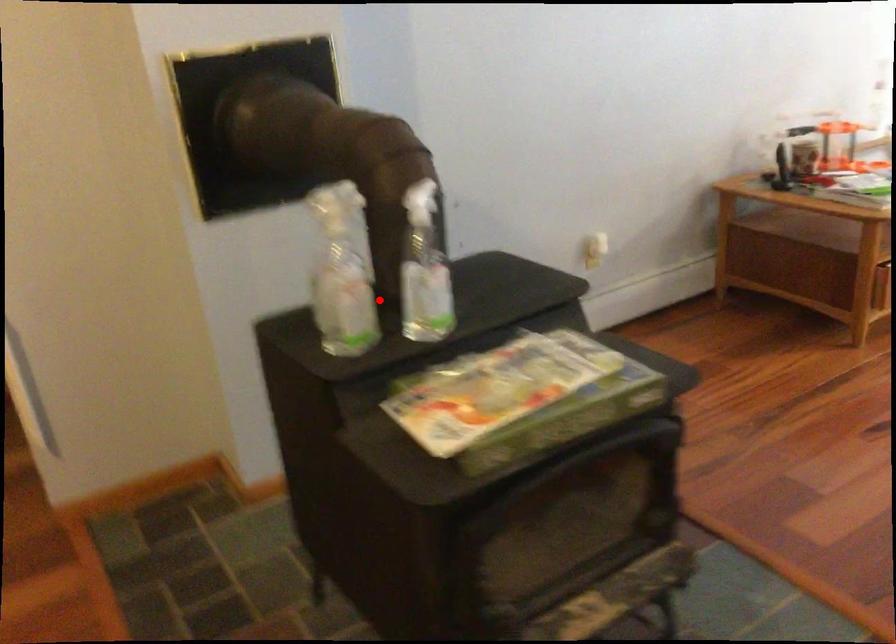
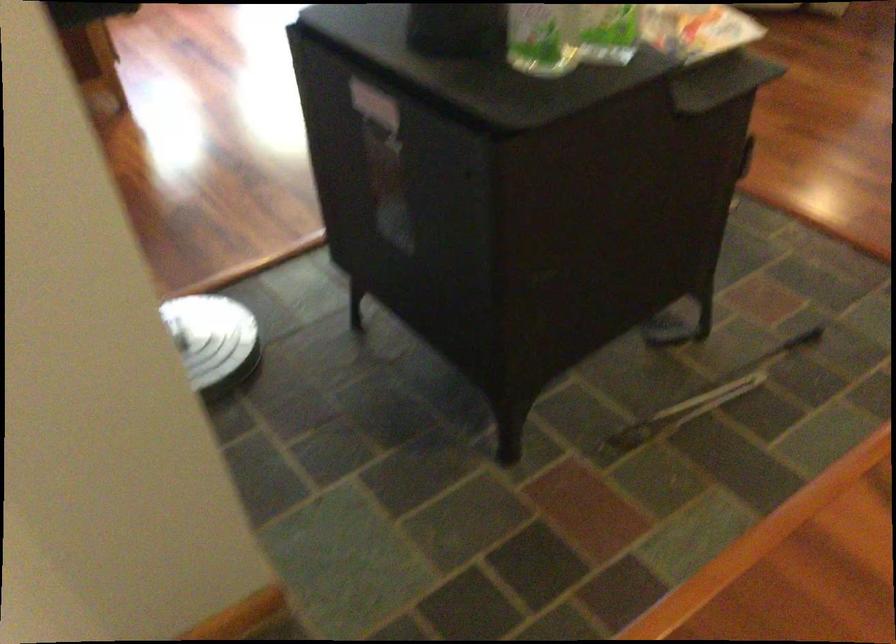
In the second image, find the point that corresponds to the highlighted location in the first image.

(375, 104)